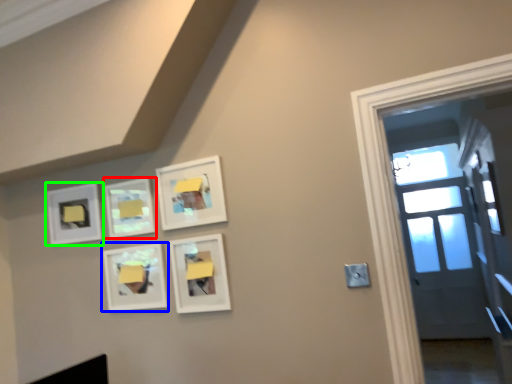
Question: Which is farther away from picture frame (highlighted by a red box)? picture frame (highlighted by a blue box) or picture frame (highlighted by a green box)?

Choices:
 (A) picture frame
 (B) picture frame

Answer: (B)